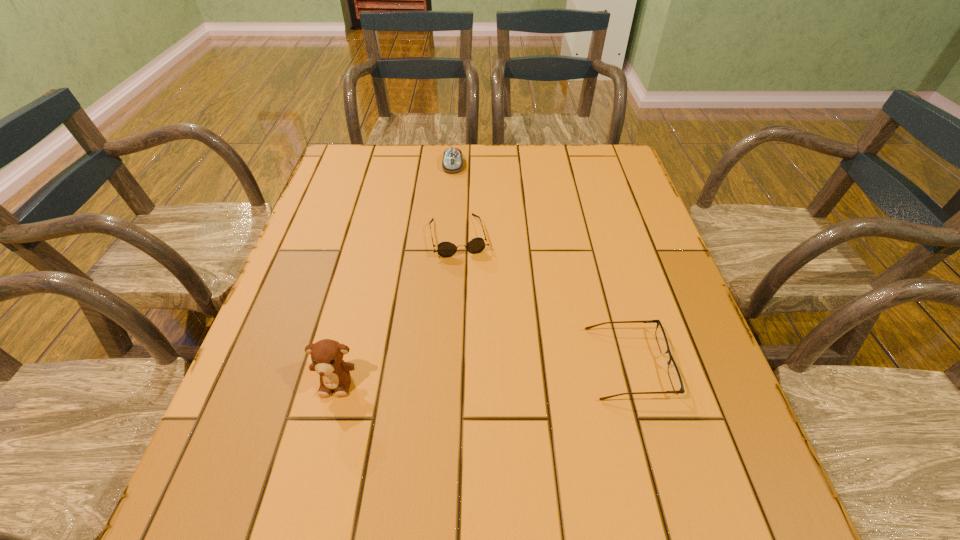
This screenshot has width=960, height=540. I want to click on vacant space positioned on the wheel side of the farthest object, so click(x=452, y=192).

Identify the location of free region located 0.200m on the wheel side of the farthest object. The image size is (960, 540). (451, 215).

Identify the location of object that is at the far edge. This screenshot has height=540, width=960. (452, 162).

Find the location of a particular element. The height and width of the screenshot is (540, 960). object that is at the left edge is located at coordinates click(x=327, y=355).

Where is `object positioned at the right edge`? object positioned at the right edge is located at coordinates (673, 372).

Identify the location of vacant space at the far edge. This screenshot has height=540, width=960. (430, 157).

Image resolution: width=960 pixels, height=540 pixels. I want to click on vacant space at the left edge of the desktop, so click(x=378, y=191).

In the image, there is a desktop. Where is `blank space at the right edge`? The width and height of the screenshot is (960, 540). blank space at the right edge is located at coordinates (610, 276).

Identify the location of blank space at the far left corner of the desktop. (348, 181).

You are a GUI agent. You are given a task and a screenshot of the screen. Output one action in this format:
    pyautogui.click(x=<x>, y=<y>)
    Task: Click on the vacant space at the near left corner of the desktop
    Image resolution: width=960 pixels, height=540 pixels.
    Given the screenshot: What is the action you would take?
    pyautogui.click(x=291, y=449)